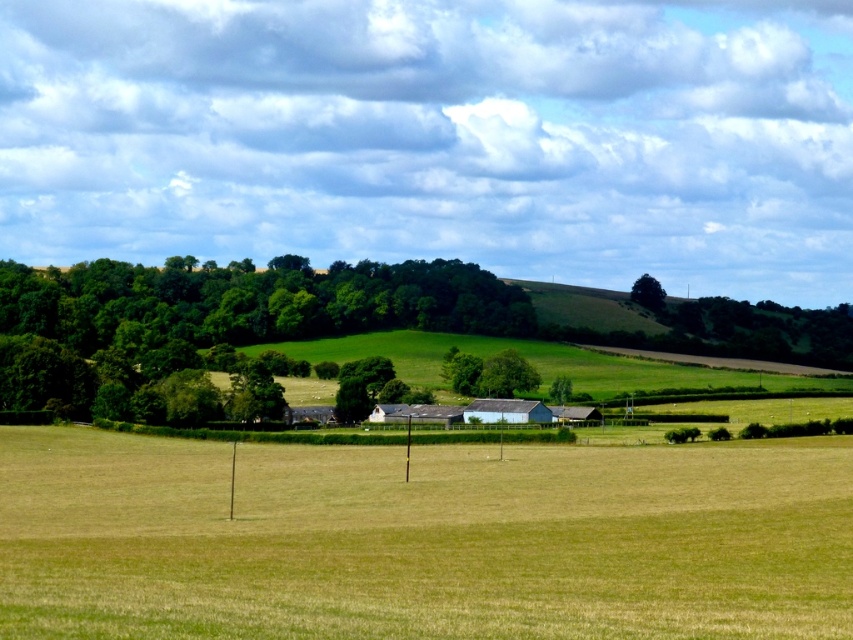
You are a landscape architect planning to plant a new tree between the green leafy trees at center and the green leafy tree at center. What is the minimum distance you need to maintain between the new tree and each existing tree to ensure they all have enough space?

The existing green leafy trees at center and green leafy tree at center are 62.70 meters apart. To ensure adequate spacing, the new tree should be planted at least 31.35 meters away from each existing tree, maintaining equal distance between all three.

You are a farmer checking the growth of your crops. You notice two plants in the center of the field, a green grass at center and a green leafy tree at center. Which plant is taller?

The green grass at center is taller than the green leafy tree at center according to the description provided.